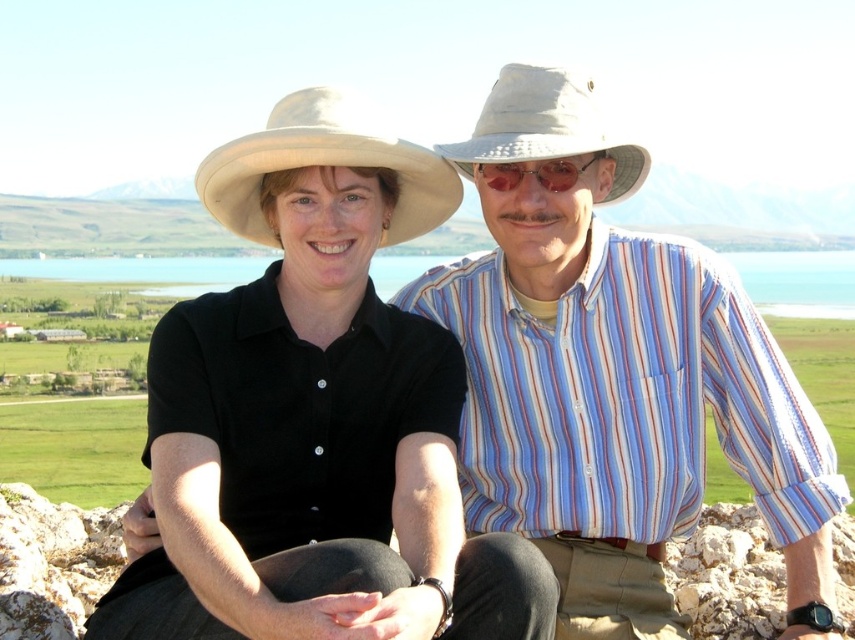
Question: Which point is closer to the camera?

Choices:
 (A) matte black hat at center
 (B) shiny metallic sunglasses at center

Answer: (A)

Question: Which point is closer to the camera?

Choices:
 (A) (551, 106)
 (B) (488, 324)
 (C) (402, 189)

Answer: (A)

Question: Does beige fabric cowboy hat at upper left have a lesser width compared to shiny metallic sunglasses at center?

Choices:
 (A) yes
 (B) no

Answer: (B)

Question: Can you confirm if matte black hat at center is bigger than shiny metallic sunglasses at center?

Choices:
 (A) yes
 (B) no

Answer: (A)

Question: Which of these objects is positioned closest to the matte black hat at center?

Choices:
 (A) beige fabric cowboy hat at upper left
 (B) beige fabric cowboy hat at upper center
 (C) shiny metallic sunglasses at center

Answer: (A)

Question: Can you confirm if matte black hat at center is positioned above beige fabric cowboy hat at upper center?

Choices:
 (A) yes
 (B) no

Answer: (B)